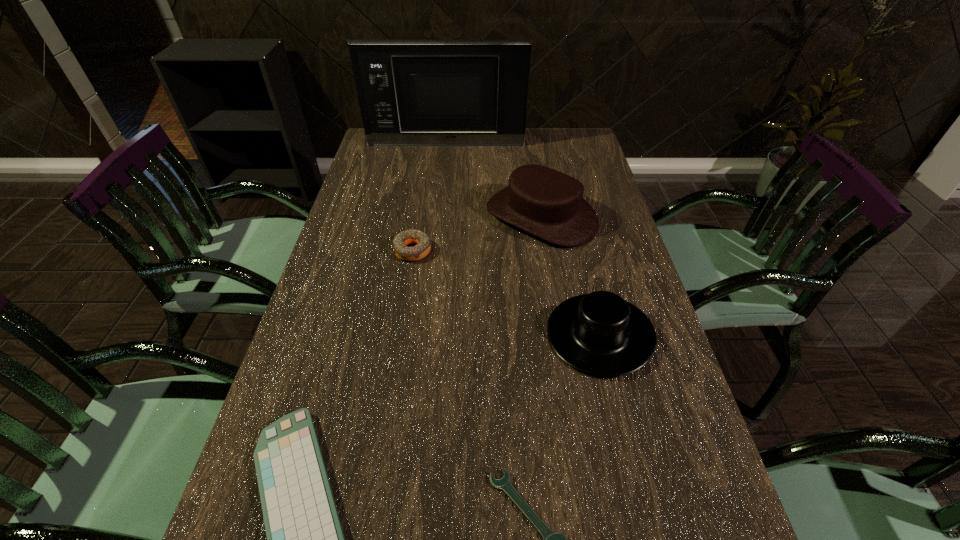
The image size is (960, 540). Identify the location of vacant space that's between the taller dress hat and the third nearest object. (570, 275).

Locate an element on the screen. This screenshot has height=540, width=960. object that stands as the second closest to the wrench is located at coordinates (305, 539).

Identify which object is located as the nearest to the farther dress hat. Please provide its 2D coordinates. Your answer should be formatted as a tuple, i.e. [(x, y)], where the tuple contains the x and y coordinates of a point satisfying the conditions above.

[(421, 250)]

You are a GUI agent. You are given a task and a screenshot of the screen. Output one action in this format:
    pyautogui.click(x=<x>, y=<y>)
    Task: Click on the vacant point that satisfies the following two spatial constraints: 1. on the front panel of the farthest object; 2. on the left side of the shorter dress hat
    
    Given the screenshot: What is the action you would take?
    pyautogui.click(x=425, y=334)